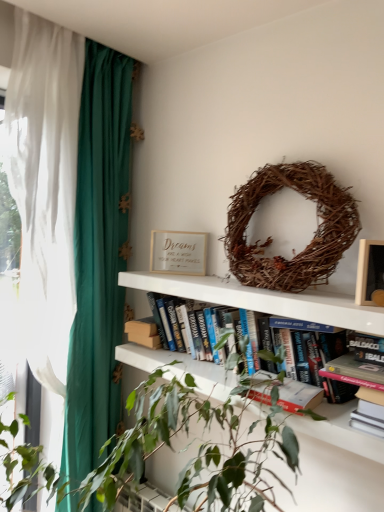
Find the location of `free spot above green fabric curtain at left (from a real-world perspective)`. free spot above green fabric curtain at left (from a real-world perspective) is located at coordinates (87, 32).